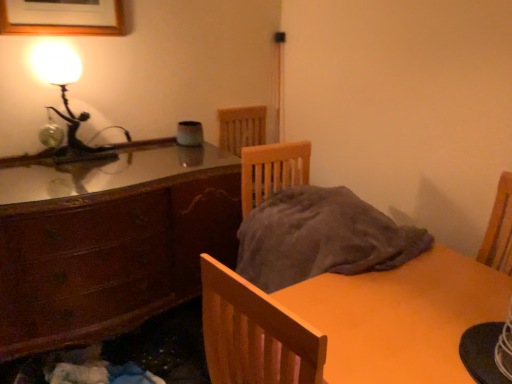
Question: Can you confirm if wooden cabinet at left is bigger than matte glass lamp at upper left?

Choices:
 (A) yes
 (B) no

Answer: (A)

Question: Is wooden cabinet at left oriented away from matte glass lamp at upper left?

Choices:
 (A) yes
 (B) no

Answer: (B)

Question: Is matte glass lamp at upper left located within wooden cabinet at left?

Choices:
 (A) no
 (B) yes

Answer: (A)

Question: Does wooden cabinet at left have a lesser width compared to matte glass lamp at upper left?

Choices:
 (A) no
 (B) yes

Answer: (A)

Question: Considering the relative positions of wooden cabinet at left and matte glass lamp at upper left in the image provided, is wooden cabinet at left to the left of matte glass lamp at upper left from the viewer's perspective?

Choices:
 (A) yes
 (B) no

Answer: (B)

Question: Considering the positions of matte glass lamp at upper left and matte wooden table at lower right in the image, is matte glass lamp at upper left bigger or smaller than matte wooden table at lower right?

Choices:
 (A) small
 (B) big

Answer: (A)

Question: Do you think matte glass lamp at upper left is within matte wooden table at lower right, or outside of it?

Choices:
 (A) outside
 (B) inside

Answer: (A)

Question: In the image, is matte glass lamp at upper left on the left side or the right side of matte wooden table at lower right?

Choices:
 (A) right
 (B) left

Answer: (B)

Question: Is point (35, 54) closer or farther from the camera than point (226, 377)?

Choices:
 (A) closer
 (B) farther

Answer: (B)

Question: Looking at their shapes, would you say matte wooden table at lower right is wider or thinner than wooden picture frame at upper left?

Choices:
 (A) wide
 (B) thin

Answer: (A)

Question: Would you say matte wooden table at lower right is inside or outside wooden picture frame at upper left?

Choices:
 (A) inside
 (B) outside

Answer: (B)

Question: Is matte wooden table at lower right bigger or smaller than wooden picture frame at upper left?

Choices:
 (A) small
 (B) big

Answer: (B)

Question: Considering the positions of matte wooden table at lower right and wooden picture frame at upper left in the image, is matte wooden table at lower right taller or shorter than wooden picture frame at upper left?

Choices:
 (A) tall
 (B) short

Answer: (A)

Question: In terms of height, does wooden picture frame at upper left look taller or shorter compared to matte glass lamp at upper left?

Choices:
 (A) short
 (B) tall

Answer: (A)

Question: Based on their positions, is wooden picture frame at upper left located to the left or right of matte glass lamp at upper left?

Choices:
 (A) right
 (B) left

Answer: (B)